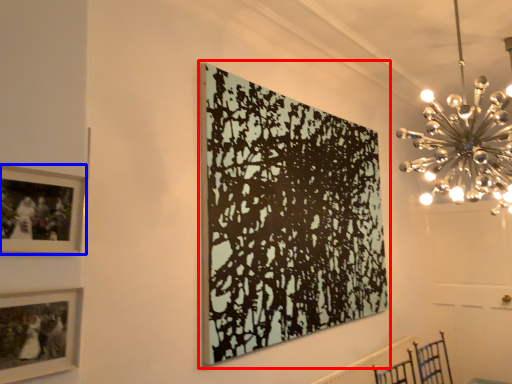
Question: Which of the following is the farthest to the observer, picture frame (highlighted by a red box) or picture frame (highlighted by a blue box)?

Choices:
 (A) picture frame
 (B) picture frame

Answer: (A)